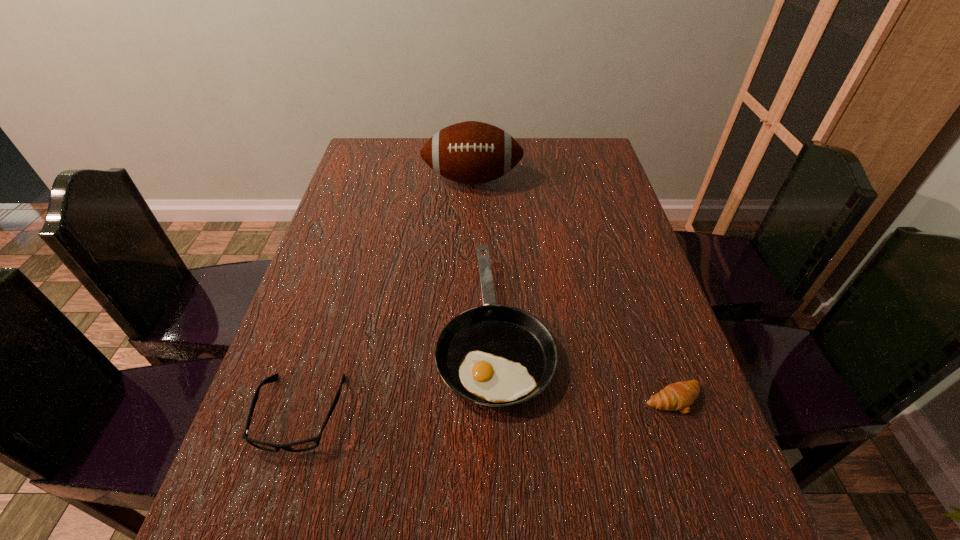
Locate an element on the screen. The width and height of the screenshot is (960, 540). free space that satisfies the following two spatial constraints: 1. on the laces of the shortest object; 2. on the right side of the tallest object is located at coordinates (468, 400).

Find the location of `vacant position in the image that satisfies the following two spatial constraints: 1. on the laces of the football; 2. on the right side of the frying pan`. vacant position in the image that satisfies the following two spatial constraints: 1. on the laces of the football; 2. on the right side of the frying pan is located at coordinates (469, 327).

Find the location of `blank area in the image that satisfies the following two spatial constraints: 1. on the laces of the farthest object; 2. on the right side of the second tallest object`. blank area in the image that satisfies the following two spatial constraints: 1. on the laces of the farthest object; 2. on the right side of the second tallest object is located at coordinates (469, 327).

Locate an element on the screen. The image size is (960, 540). vacant space that satisfies the following two spatial constraints: 1. on the laces of the farthest object; 2. on the left side of the frying pan is located at coordinates (469, 327).